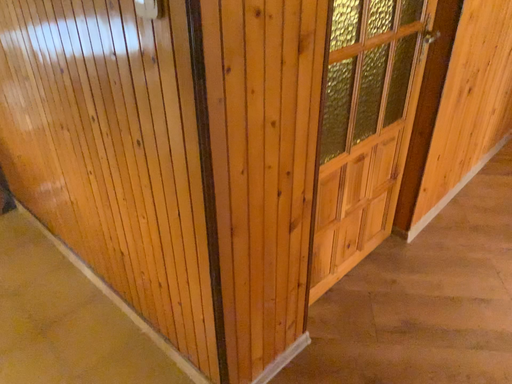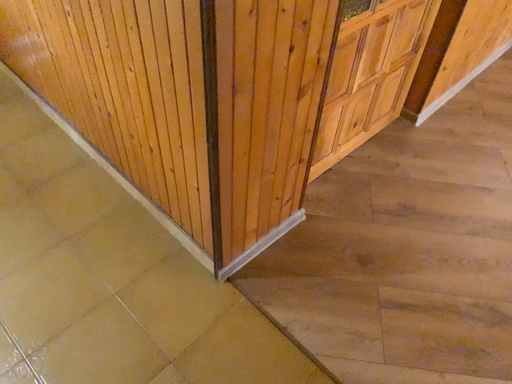
Question: Which way did the camera rotate in the video?

Choices:
 (A) rotated upward
 (B) rotated downward

Answer: (B)